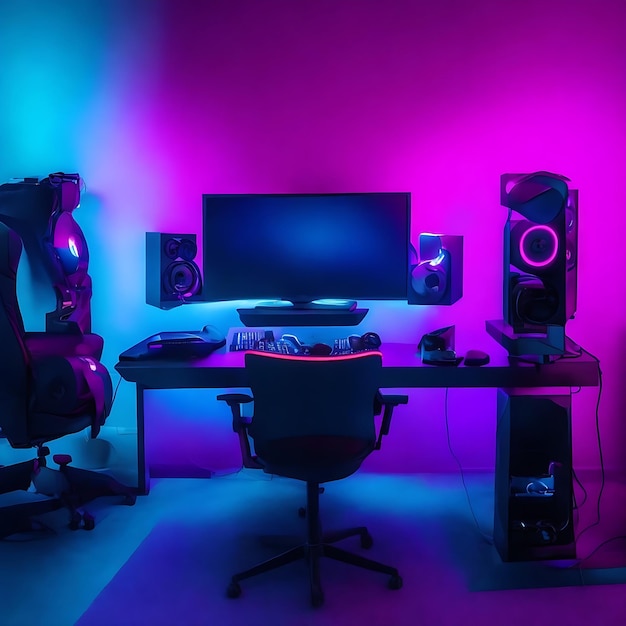
Where is `computer monitor`? This screenshot has width=626, height=626. computer monitor is located at coordinates (267, 193).